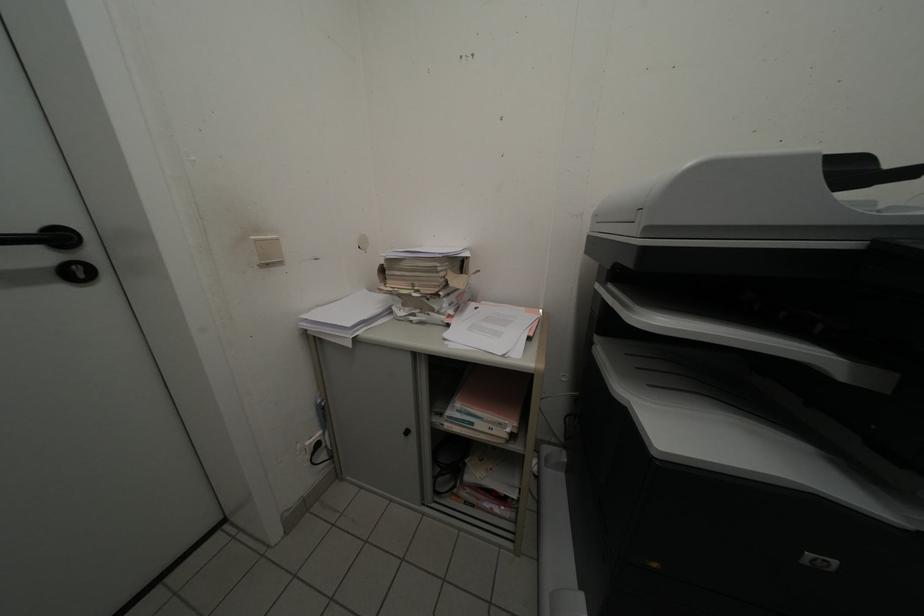
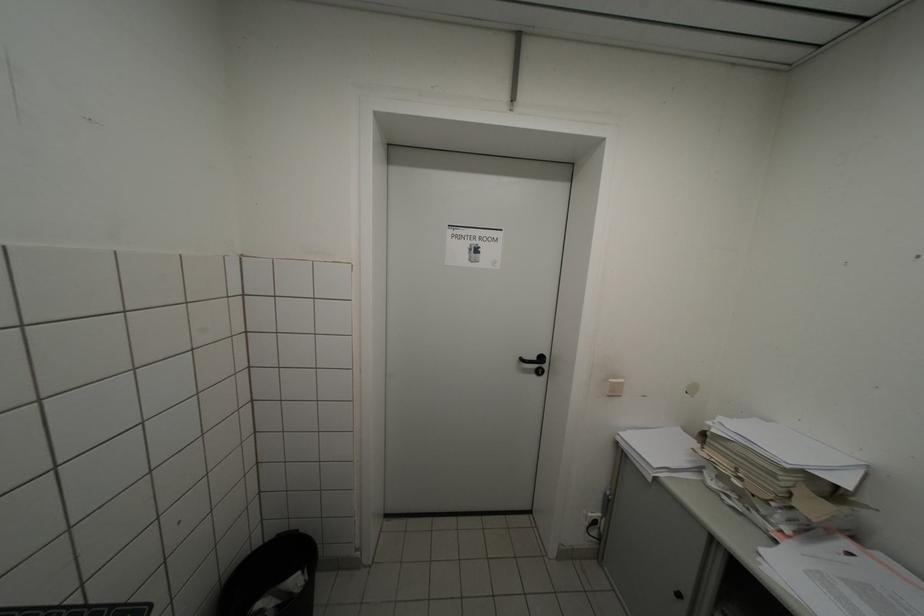
Locate, in the second image, the point that corresponds to (261,240) in the first image.

(618, 383)